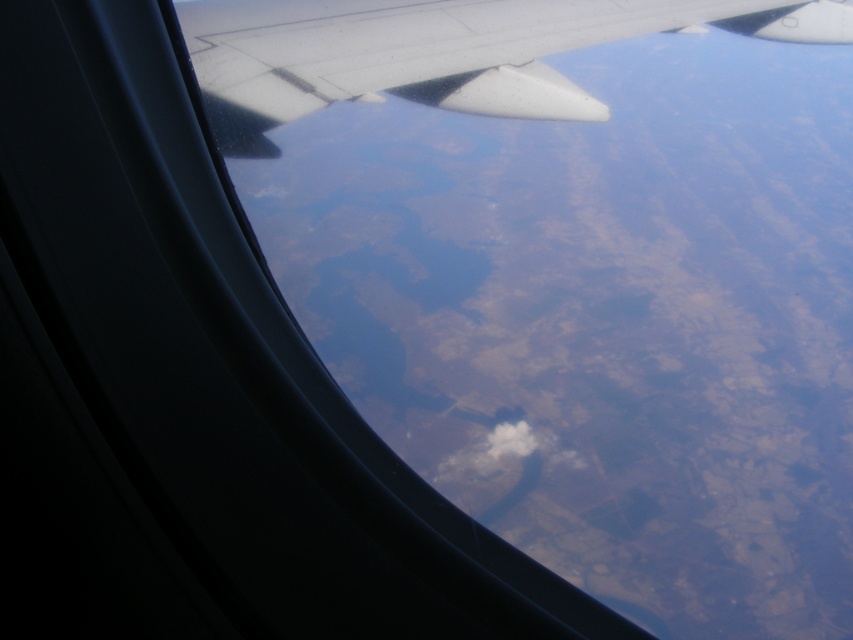
Does white matte wing at upper center have a larger size compared to white fluffy cloud at center?

Actually, white matte wing at upper center might be smaller than white fluffy cloud at center.

Measure the distance between white matte wing at upper center and camera.

white matte wing at upper center is 2.24 meters from camera.

Which is in front, point (265, 45) or point (482, 435)?

Point (265, 45) is more forward.

Where is `white matte wing at upper center`? The width and height of the screenshot is (853, 640). white matte wing at upper center is located at coordinates (440, 52).